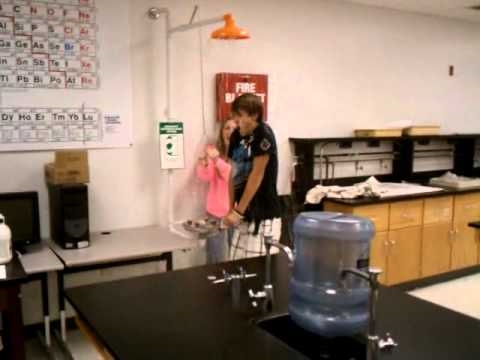
Find the location of a particular element. floor is located at coordinates (457, 291).